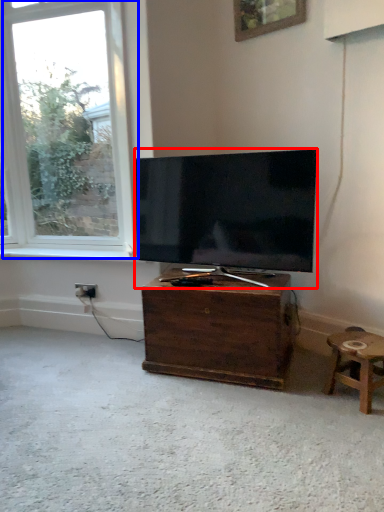
Question: Which of the following is the closest to the observer, television (highlighted by a red box) or window (highlighted by a blue box)?

Choices:
 (A) television
 (B) window

Answer: (A)